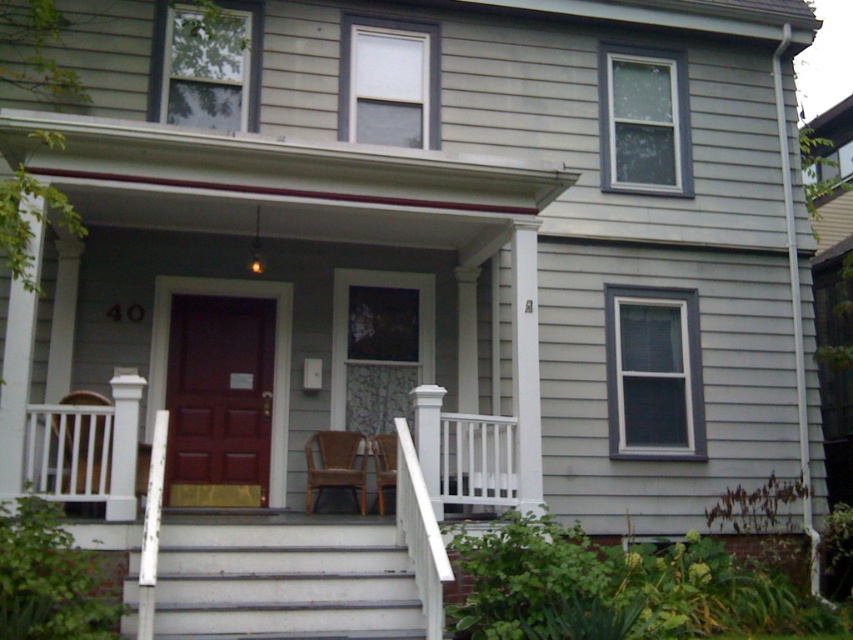
Based on the photo, you are standing at the front door of the house. There is a white wooden chair at lower left marked by point (84, 397). If you want to move the chair closer to the front door, which direction should you move it?

The white wooden chair at lower left marked by point (84, 397) should be moved towards the front door by moving it to the right since the chair is located at the lower left position relative to the door.